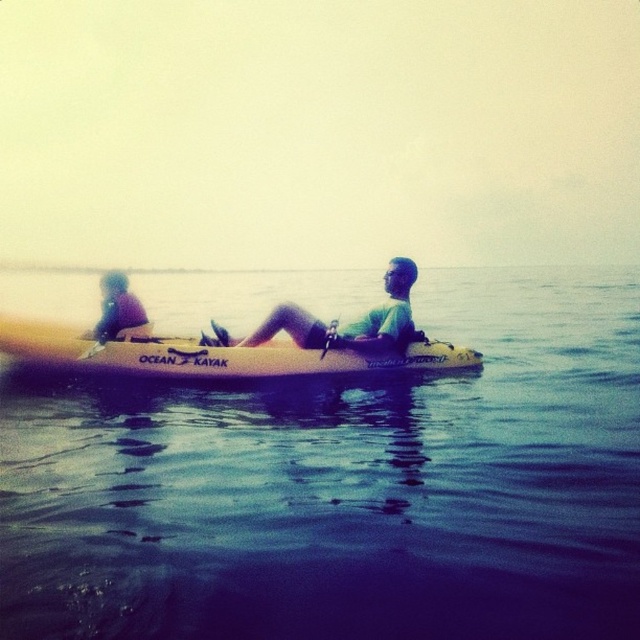
You are planning to take a photo of the blue water at center and the green matte kayak at center from above. Based on their heights, which one will appear larger in the photo?

The blue water at center has a greater height compared to the green matte kayak at center, so it will appear larger in the photo.